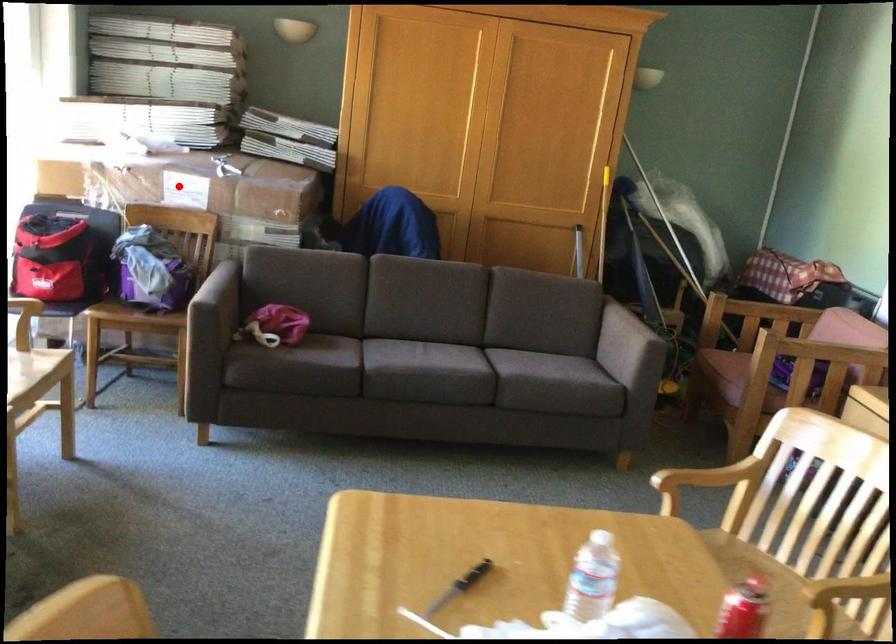
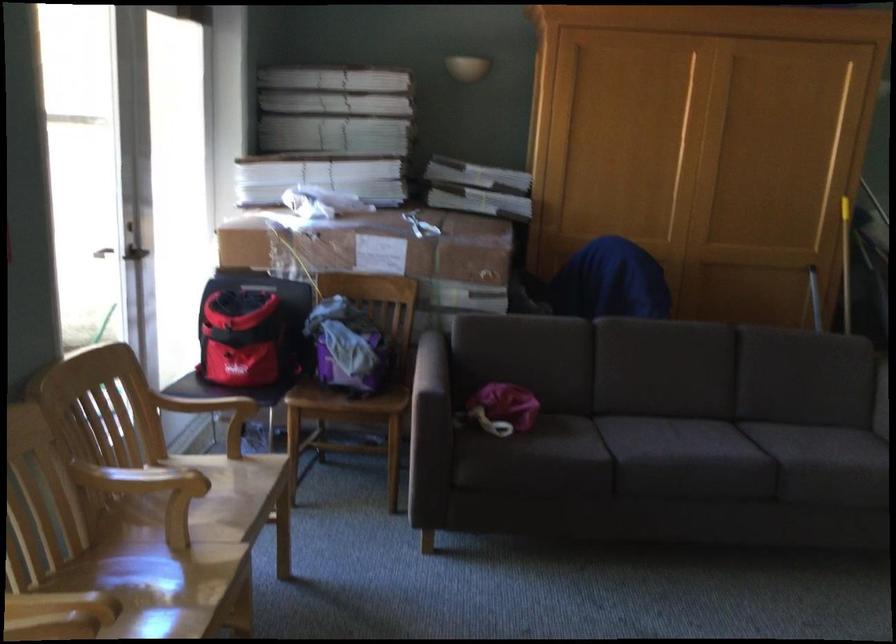
Locate, in the second image, the point that corresponds to the highlighted location in the first image.

(371, 245)